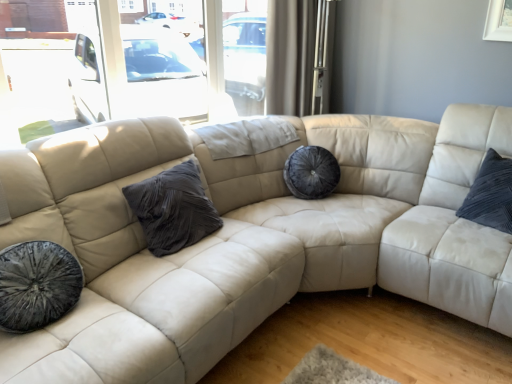
Question: Is white sheer curtain at upper center outside of velvet dark gray pillow at center?

Choices:
 (A) no
 (B) yes

Answer: (B)

Question: Does white sheer curtain at upper center have a greater width compared to velvet dark gray pillow at center?

Choices:
 (A) no
 (B) yes

Answer: (A)

Question: Could you tell me if white sheer curtain at upper center is turned towards velvet dark gray pillow at center?

Choices:
 (A) no
 (B) yes

Answer: (A)

Question: From a real-world perspective, is white sheer curtain at upper center on top of velvet dark gray pillow at center?

Choices:
 (A) no
 (B) yes

Answer: (B)

Question: Would you say velvet dark gray pillow at center is part of white sheer curtain at upper center's contents?

Choices:
 (A) no
 (B) yes

Answer: (A)

Question: Considering the relative sizes of white sheer curtain at upper center and velvet dark gray pillow at center in the image provided, is white sheer curtain at upper center thinner than velvet dark gray pillow at center?

Choices:
 (A) yes
 (B) no

Answer: (A)

Question: Does velvet dark gray pillow at center have a lesser height compared to white sheer curtain at upper center?

Choices:
 (A) yes
 (B) no

Answer: (A)

Question: From a real-world perspective, is velvet dark gray pillow at center under white sheer curtain at upper center?

Choices:
 (A) yes
 (B) no

Answer: (A)

Question: From a real-world perspective, is velvet dark gray pillow at center on white sheer curtain at upper center?

Choices:
 (A) yes
 (B) no

Answer: (B)

Question: From the image's perspective, is velvet dark gray pillow at center located beneath white sheer curtain at upper center?

Choices:
 (A) no
 (B) yes

Answer: (B)

Question: Is velvet dark gray pillow at center turned away from white sheer curtain at upper center?

Choices:
 (A) yes
 (B) no

Answer: (B)

Question: Does velvet dark gray pillow at center appear on the left side of white sheer curtain at upper center?

Choices:
 (A) yes
 (B) no

Answer: (A)

Question: From a real-world perspective, is white sheer curtain at upper center positioned above or below velvet dark gray pillow at center?

Choices:
 (A) above
 (B) below

Answer: (A)